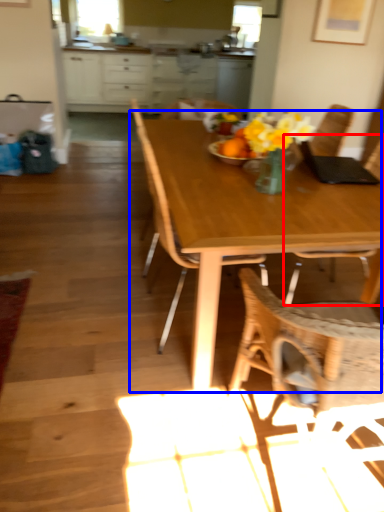
Question: Which object appears farthest to the camera in this image, chair (highlighted by a red box) or kitchen & dining room table (highlighted by a blue box)?

Choices:
 (A) chair
 (B) kitchen & dining room table

Answer: (A)